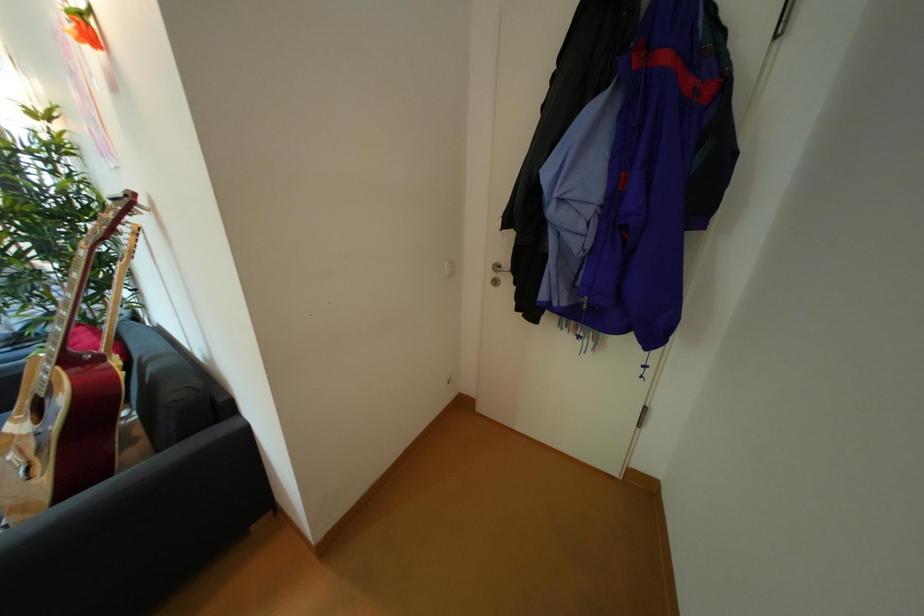
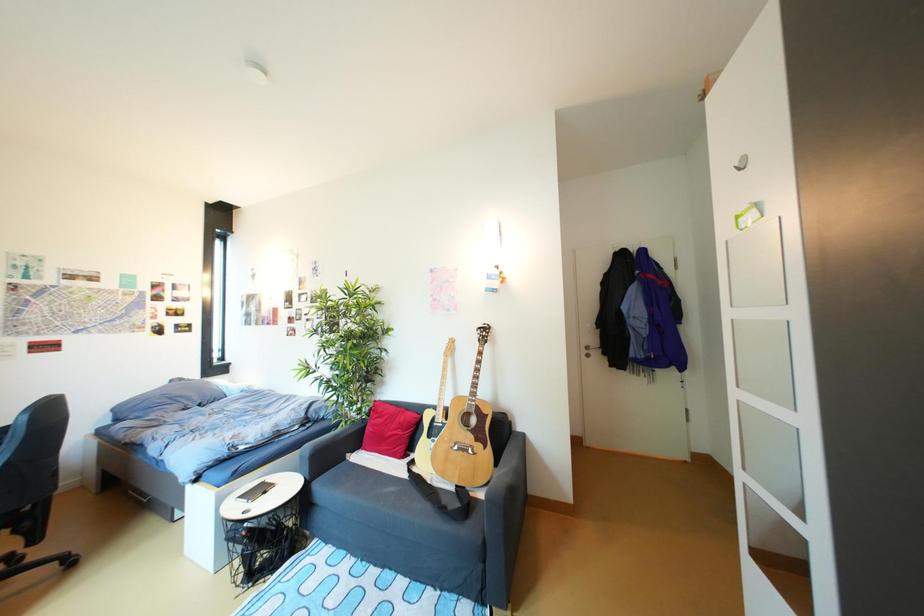
Which direction would the cameraman need to move to produce the second image?

The movement direction of the cameraman is left, backward.